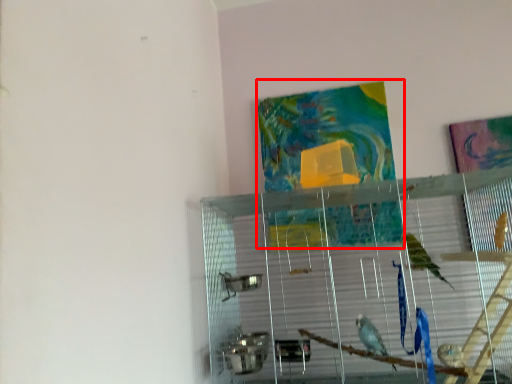
Question: From the image's perspective, what is the correct spatial positioning of tapestry (annotated by the red box) in reference to glass box?

Choices:
 (A) below
 (B) above

Answer: (B)